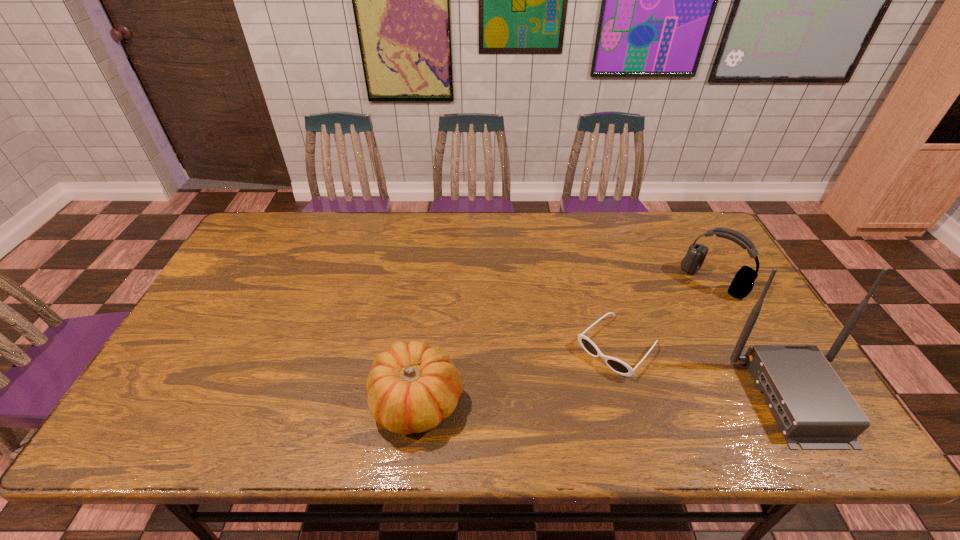
At what (x,y) coordinates should I click in order to perform the action: click on vacant space located 0.200m on the headband of the farthest object. Please return your answer as a coordinate pair (x, y). This screenshot has width=960, height=540. Looking at the image, I should click on (665, 331).

Where is `vacant region located 0.120m on the headband of the farthest object`? vacant region located 0.120m on the headband of the farthest object is located at coordinates (680, 316).

Where is `gourd that is at the near edge`? gourd that is at the near edge is located at coordinates (412, 387).

Identify the location of router situated at the near edge. (813, 408).

Where is `sunglasses that is at the near edge`? sunglasses that is at the near edge is located at coordinates (618, 366).

The height and width of the screenshot is (540, 960). I want to click on router at the right edge, so click(813, 408).

What are the coordinates of `headset located in the right edge section of the desktop` in the screenshot? It's located at (742, 284).

The width and height of the screenshot is (960, 540). Find the location of `object that is at the near right corner`. object that is at the near right corner is located at coordinates (813, 408).

This screenshot has height=540, width=960. In order to click on vacant space at the far edge in this screenshot , I will do `click(640, 236)`.

Identify the location of free spot at the near edge of the desktop. (623, 379).